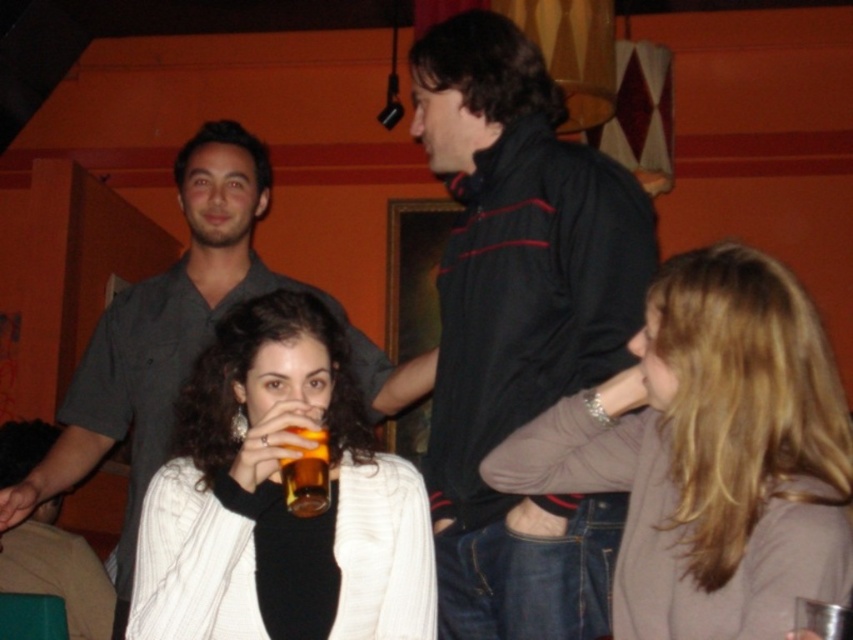
What do you see at coordinates (709, 452) in the screenshot? I see `matte gray sweater at center` at bounding box center [709, 452].

Is point (631, 614) farther from viewer compared to point (80, 435)?

No, (631, 614) is closer to viewer.

Which is in front, point (590, 474) or point (207, 241)?

Point (590, 474) is more forward.

I want to click on matte gray sweater at center, so click(x=709, y=452).

Is point (486, 68) closer to camera compared to point (206, 340)?

That is True.

Does black fleece jacket at center appear under dark gray shirt at center?

No.

Is point (434, 532) closer to camera compared to point (357, 349)?

Yes, point (434, 532) is in front of point (357, 349).

Find the location of a particular element. This screenshot has height=640, width=853. black fleece jacket at center is located at coordinates (520, 326).

Is black fleece jacket at center bigger than matte gray sweater at center?

Yes.

Who is taller, black fleece jacket at center or matte gray sweater at center?

Standing taller between the two is black fleece jacket at center.

Is point (483, 605) positioned behind point (691, 516)?

Yes, it is.

Locate an element on the screen. black fleece jacket at center is located at coordinates (520, 326).